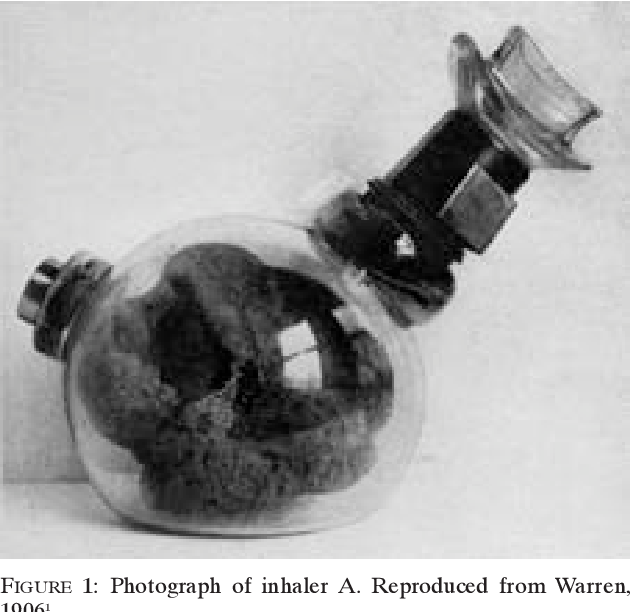
You are a GUI agent. You are given a task and a screenshot of the screen. Output one action in this format:
    pyautogui.click(x=<x>, y=<y>)
    Task: Click on the wall
    The height and width of the screenshot is (612, 632).
    Given the screenshot: What is the action you would take?
    pos(243,92)